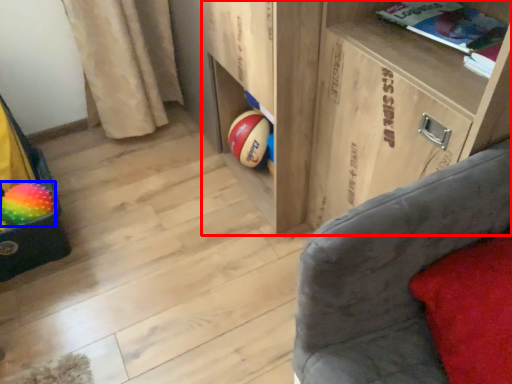
Question: Which object is further to the camera taking this photo, shelf (highlighted by a red box) or beach ball (highlighted by a blue box)?

Choices:
 (A) shelf
 (B) beach ball

Answer: (B)